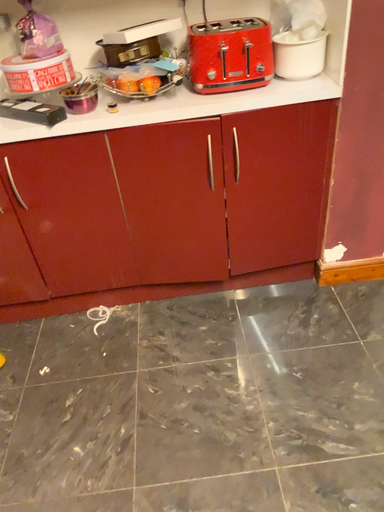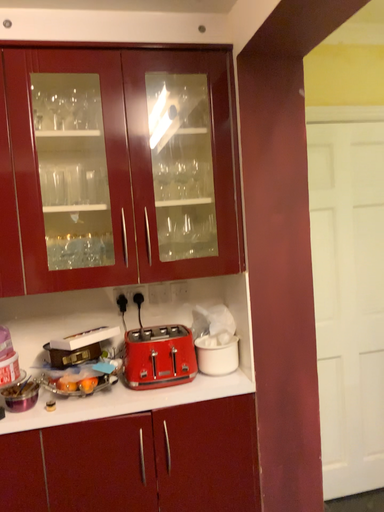
Question: Which way did the camera rotate in the video?

Choices:
 (A) rotated left
 (B) rotated right

Answer: (B)